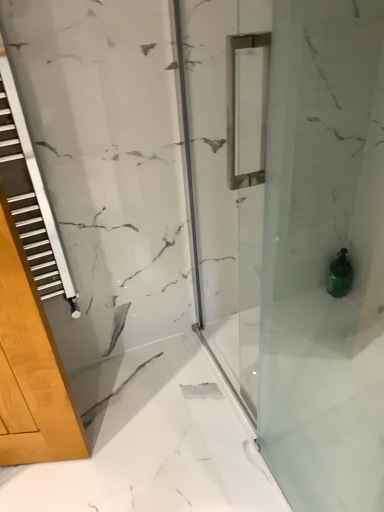
Question: Considering the positions of transparent glass shower door at center and green glass bottle at lower right in the image, is transparent glass shower door at center taller or shorter than green glass bottle at lower right?

Choices:
 (A) tall
 (B) short

Answer: (A)

Question: Do you think transparent glass shower door at center is within green glass bottle at lower right, or outside of it?

Choices:
 (A) inside
 (B) outside

Answer: (B)

Question: From a real-world perspective, relative to green glass bottle at lower right, is transparent glass shower door at center vertically above or below?

Choices:
 (A) below
 (B) above

Answer: (B)

Question: Is green glass bottle at lower right wider or thinner than transparent glass shower door at center?

Choices:
 (A) wide
 (B) thin

Answer: (A)

Question: From the image's perspective, relative to transparent glass shower door at center, is green glass bottle at lower right above or below?

Choices:
 (A) above
 (B) below

Answer: (B)

Question: In the image, is green glass bottle at lower right on the left side or the right side of transparent glass shower door at center?

Choices:
 (A) left
 (B) right

Answer: (B)

Question: Considering the positions of green glass bottle at lower right and transparent glass shower door at center in the image, is green glass bottle at lower right bigger or smaller than transparent glass shower door at center?

Choices:
 (A) big
 (B) small

Answer: (B)